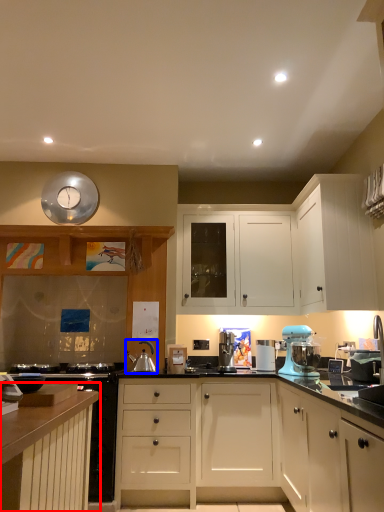
Question: Which object appears closest to the camera in this image, cabinetry (highlighted by a red box) or appliance (highlighted by a blue box)?

Choices:
 (A) cabinetry
 (B) appliance

Answer: (A)